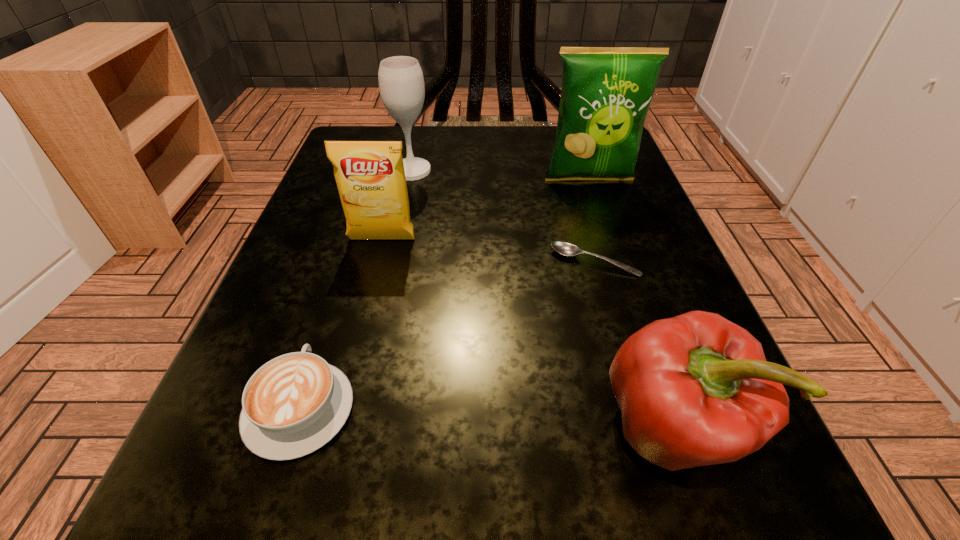
This screenshot has width=960, height=540. I want to click on crisp (potato chip) situated at the left edge, so click(370, 176).

Find the location of `cappuccino present at the left edge`. cappuccino present at the left edge is located at coordinates (294, 404).

What are the coordinates of `crisp (potato chip) that is at the right edge` in the screenshot? It's located at (606, 92).

Identify the location of bell pepper positioned at the right edge. point(694,390).

Identify the location of soupspoon that is at the right edge. (564, 248).

The height and width of the screenshot is (540, 960). I want to click on object present at the far left corner, so click(401, 83).

Locate an element on the screen. This screenshot has width=960, height=540. object that is at the far right corner is located at coordinates (606, 92).

Locate an element on the screen. Image resolution: width=960 pixels, height=540 pixels. object that is at the near right corner is located at coordinates pos(694,390).

Find the location of a particular element. The width and height of the screenshot is (960, 540). vacant space at the far edge of the desktop is located at coordinates (424, 157).

Image resolution: width=960 pixels, height=540 pixels. In order to click on vacant space at the near edge in this screenshot , I will do `click(607, 482)`.